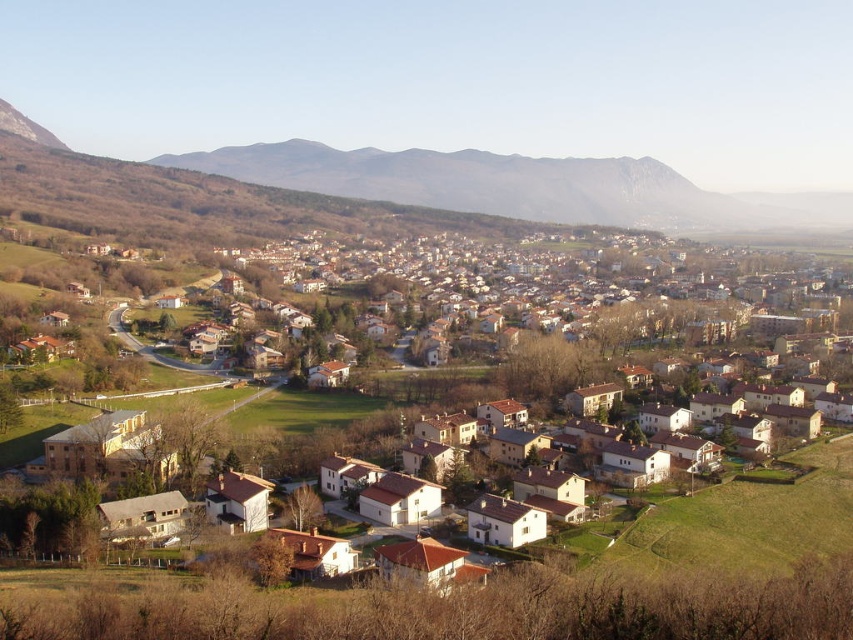
You are a drone operator tasked with capturing aerial footage of the town. You need to ensure that both the white matte houses at center and the brown rocky mountain at upper center are clearly visible in the shot. Given their sizes, which object should you prioritize keeping closer to the drone to ensure clarity?

The white matte houses at center are larger in size compared to the brown rocky mountain at upper center. To ensure clarity in the aerial footage, you should prioritize keeping the white matte houses at center closer to the drone since larger objects require less magnification to appear clear, whereas the smaller brown rocky mountain at upper center can be positioned slightly farther away and still remain visible.

You are standing at the point marked by the coordinates point (590, 408) in the image. Looking around, you see white matte houses at center. Which direction should you face to see the houses with red roofs in the foreground?

The point (590, 408) is marked at white matte houses at center. To see the houses with red roofs in the foreground, you should face towards the foreground area, which is likely in the lower part of the image since foreground elements are typically closer to the viewer.